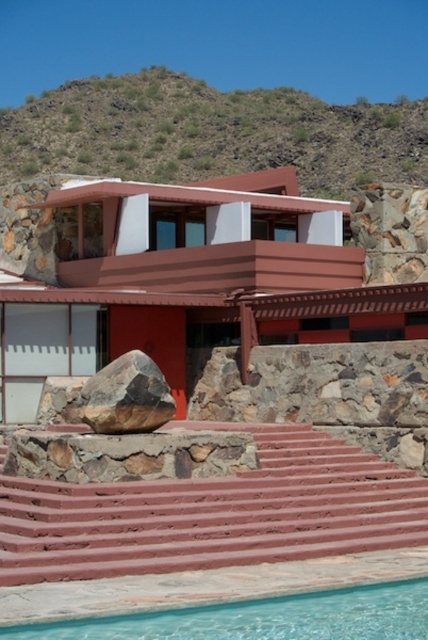
You are standing at the base of the structure and looking towards the rugged hills. Which object, the green grassy hillside at upper center or the brown rough rock at lower center, is positioned to the right side from your viewpoint?

The green grassy hillside at upper center is positioned to the right of the brown rough rock at lower center, so from your viewpoint, the green grassy hillside at upper center is on the right side.

You are standing at the base of the green grassy hillside at upper center and want to throw a ball to a friend who is standing at the edge of the building. The ball can travel up to 90 meters. Will the ball reach your friend?

The green grassy hillside at upper center and viewer are 88.73 meters apart, so yes, the ball can reach your friend since the distance is within the ball travel limit of 90 meters.

You are standing at the entrance of the building and looking towards the clear glass pool at lower center. There is a green grassy hillside at upper center behind the pool. Which object is larger in size?

The green grassy hillside at upper center is bigger than the clear glass pool at lower center.